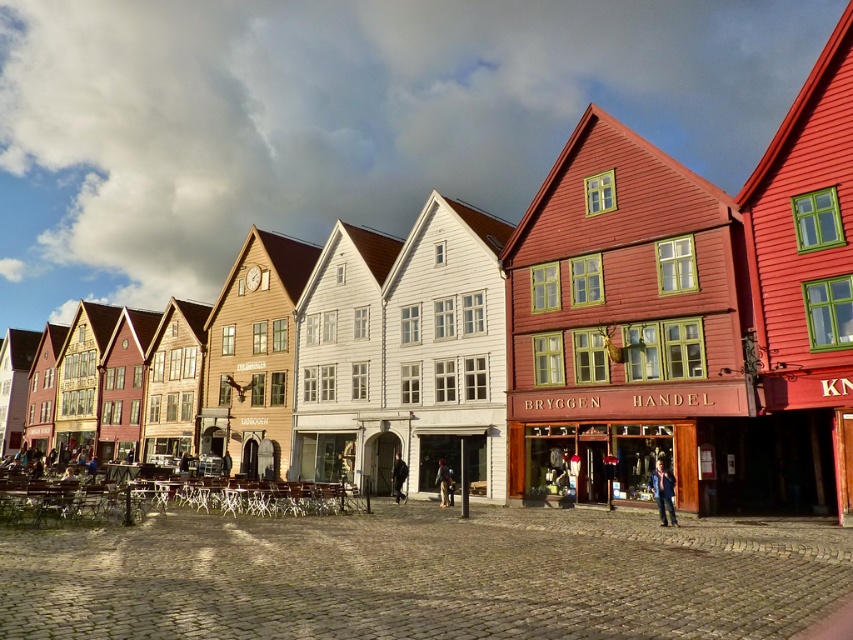
You are standing on the cobblestone street in front of the colorful buildings and notice two points marked on the ground. The first point is at coordinates point [555,461] and the second is at point [656,465]. Which point is closer to you?

Point [555,461] is closer to you because it is further to the viewer than point [656,465].